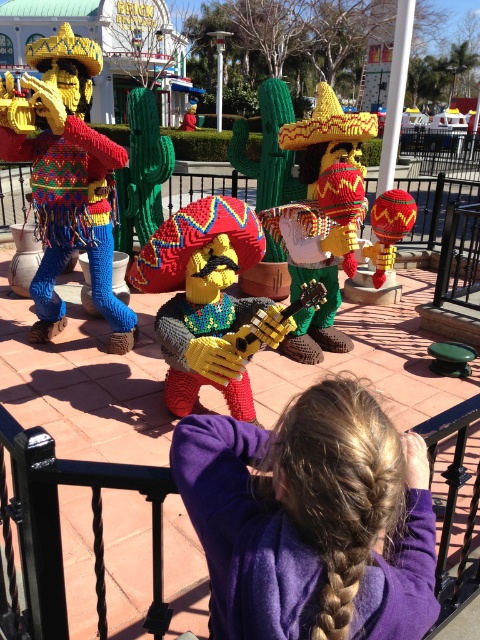
Which of these two, knitted yellow hat at center or knitted yarn hot air balloon at center, stands taller?

With more height is knitted yellow hat at center.

Does point (324, 259) come in front of point (376, 220)?

No, it is not.

Is point (343, 259) in front of point (375, 276)?

Yes, point (343, 259) is in front of point (375, 276).

Find the location of a particular element. This screenshot has height=640, width=480. knitted yellow hat at center is located at coordinates (322, 218).

Does purple fleece jacket at lower center appear on the left side of brick-like guitar at center?

Incorrect, purple fleece jacket at lower center is not on the left side of brick-like guitar at center.

Can you confirm if purple fleece jacket at lower center is smaller than brick-like guitar at center?

Yes.

Identify the location of purple fleece jacket at lower center. (310, 520).

Can you confirm if brick-like guitar at center is smaller than knitted yellow hat at center?

Indeed, brick-like guitar at center has a smaller size compared to knitted yellow hat at center.

Between point (189, 323) and point (324, 259), which one is positioned behind?

The point (324, 259) is behind.

This screenshot has height=640, width=480. In order to click on brick-like guitar at center in this screenshot , I will do `click(204, 300)`.